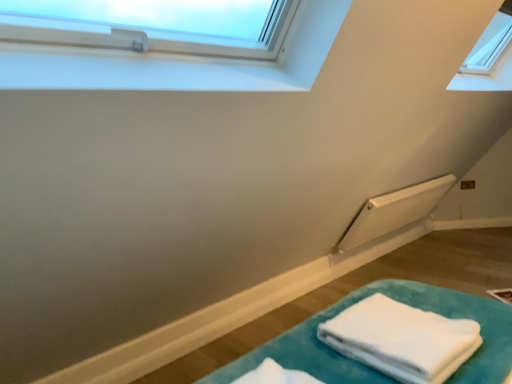
Question: Should I look upward or downward to see white soft towel at lower right?

Choices:
 (A) up
 (B) down

Answer: (B)